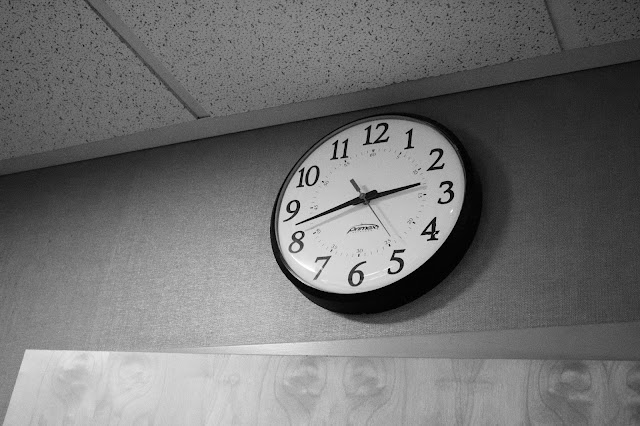
In order to click on clock border in this screenshot , I will do `click(448, 257)`.